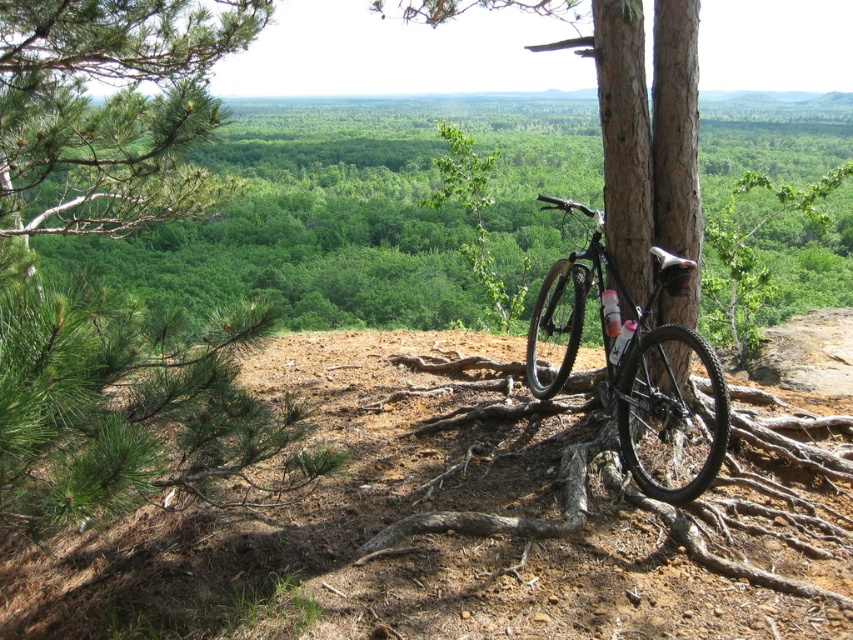
Between matte black bicycle at center and shiny black bicycle at center, which one has more height?

With more height is matte black bicycle at center.

What do you see at coordinates (361, 211) in the screenshot? This screenshot has height=640, width=853. I see `matte black bicycle at center` at bounding box center [361, 211].

The width and height of the screenshot is (853, 640). What are the coordinates of `matte black bicycle at center` in the screenshot? It's located at (361, 211).

Who is more distant from viewer, (135, 458) or (670, 509)?

Point (670, 509)

Can you confirm if green pine tree at upper left is thinner than brown rough tree roots at center?

Yes.

Which is behind, point (177, 484) or point (775, 577)?

The point (177, 484) is more distant.

At what (x,y) coordinates should I click in order to perform the action: click on green pine tree at upper left. Please return your answer as a coordinate pair (x, y). Looking at the image, I should click on (111, 236).

Is point (279, 244) more distant than point (624, 486)?

Yes, point (279, 244) is farther from viewer.

Which of these two, matte black bicycle at center or brown rough tree roots at center, stands taller?

matte black bicycle at center

Is point (351, 188) behind point (527, 524)?

Yes, point (351, 188) is behind point (527, 524).

Image resolution: width=853 pixels, height=640 pixels. I want to click on matte black bicycle at center, so (361, 211).